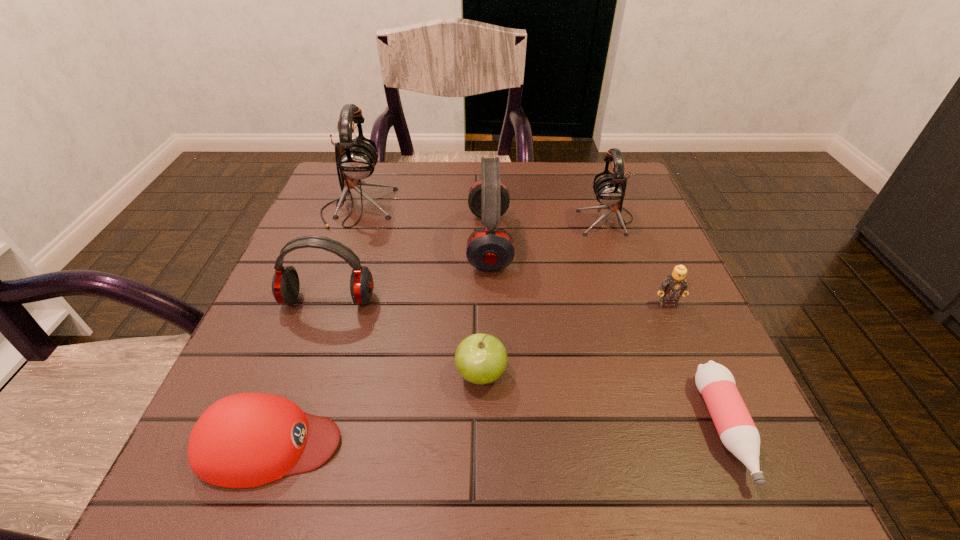
Where is `object that is at the far right corner`? object that is at the far right corner is located at coordinates (609, 189).

You are a GUI agent. You are given a task and a screenshot of the screen. Output one action in this format:
    pyautogui.click(x=<x>, y=<y>)
    Task: Click on the object that is at the near right corner
    The height and width of the screenshot is (540, 960).
    Given the screenshot: What is the action you would take?
    pyautogui.click(x=737, y=431)

This screenshot has width=960, height=540. In the image, there is a desktop. In order to click on vacant space at the far edge in this screenshot , I will do `click(415, 190)`.

The width and height of the screenshot is (960, 540). I want to click on vacant space at the near edge, so click(x=600, y=497).

This screenshot has height=540, width=960. Identify the location of free space at the left edge of the desktop. (358, 217).

This screenshot has height=540, width=960. Find the location of `vacant space at the right edge of the desktop`. vacant space at the right edge of the desktop is located at coordinates (701, 338).

Locate an element on the screen. vacant space at the near left corner is located at coordinates (213, 497).

The height and width of the screenshot is (540, 960). I want to click on vacant region at the far right corner of the desktop, so coord(641,197).

You are a GUI agent. You are given a task and a screenshot of the screen. Output one action in this format:
    pyautogui.click(x=<x>, y=<y>)
    Task: Click on the free spot at the near right corner of the desktop
    The height and width of the screenshot is (540, 960).
    Given the screenshot: What is the action you would take?
    pyautogui.click(x=676, y=443)

Where is `vacant area that lies between the shortest object and the bigger red earphone`? Image resolution: width=960 pixels, height=540 pixels. vacant area that lies between the shortest object and the bigger red earphone is located at coordinates click(x=607, y=335).